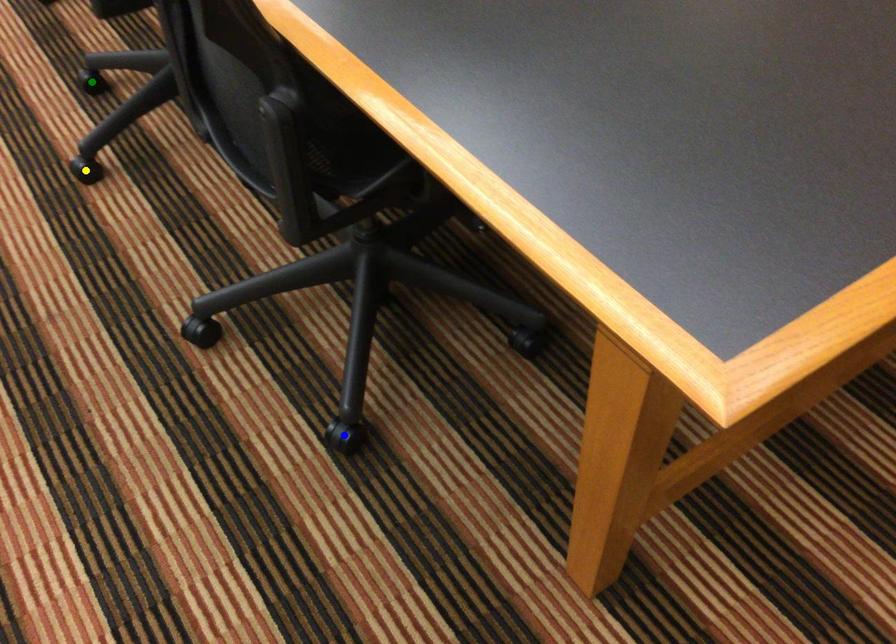
Consider the image. Order these from nearest to farthest:
1. green point
2. blue point
3. yellow point

1. blue point
2. yellow point
3. green point